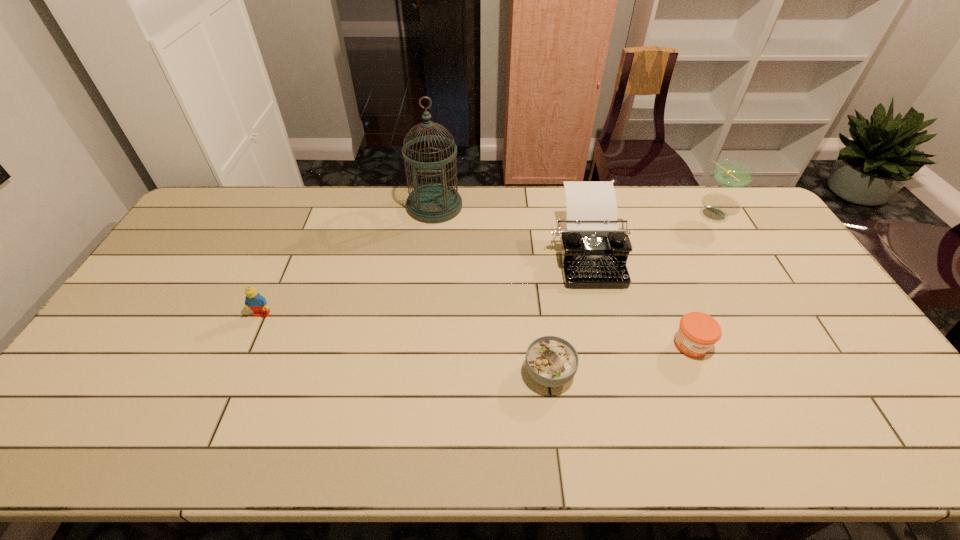
You are a GUI agent. You are given a task and a screenshot of the screen. Output one action in this format:
    pyautogui.click(x=<x>, y=<y>)
    Task: Click on the vacant area situated on the left of the rightmost object
    Image resolution: width=960 pixels, height=540 pixels.
    Given the screenshot: What is the action you would take?
    pyautogui.click(x=635, y=215)

I want to click on vacant region located on the keys of the typewriter, so click(601, 313).

The image size is (960, 540). Find the location of `vacant space situated 0.390m on the face of the third shortest object`. vacant space situated 0.390m on the face of the third shortest object is located at coordinates (200, 456).

Find the location of a particular element. The width and height of the screenshot is (960, 540). vacant space located on the front label of the second object from right to left is located at coordinates (713, 399).

I want to click on vacant area situated 0.090m on the front of the soup bowl, so click(557, 431).

Find the location of a particular element. This screenshot has height=540, width=960. birdcage at the far edge is located at coordinates (433, 203).

What are the coordinates of `martini located in the far edge section of the desktop` in the screenshot? It's located at (732, 173).

Locate an element on the screen. This screenshot has height=540, width=960. typewriter at the far edge is located at coordinates (594, 252).

Identify the location of object located at the right edge. (732, 173).

Find the location of a particular element. The height and width of the screenshot is (540, 960). object that is positioned at the far right corner is located at coordinates (732, 173).